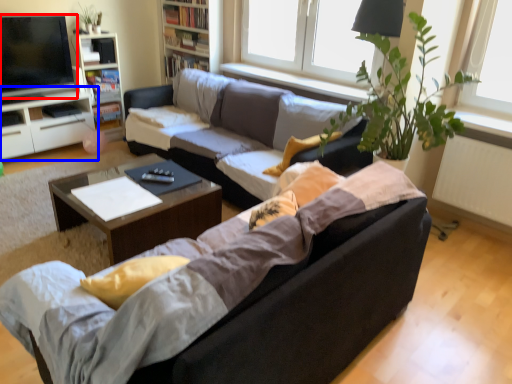
Question: Which object appears farthest to the camera in this image, television (highlighted by a red box) or cabinetry (highlighted by a blue box)?

Choices:
 (A) television
 (B) cabinetry

Answer: (B)